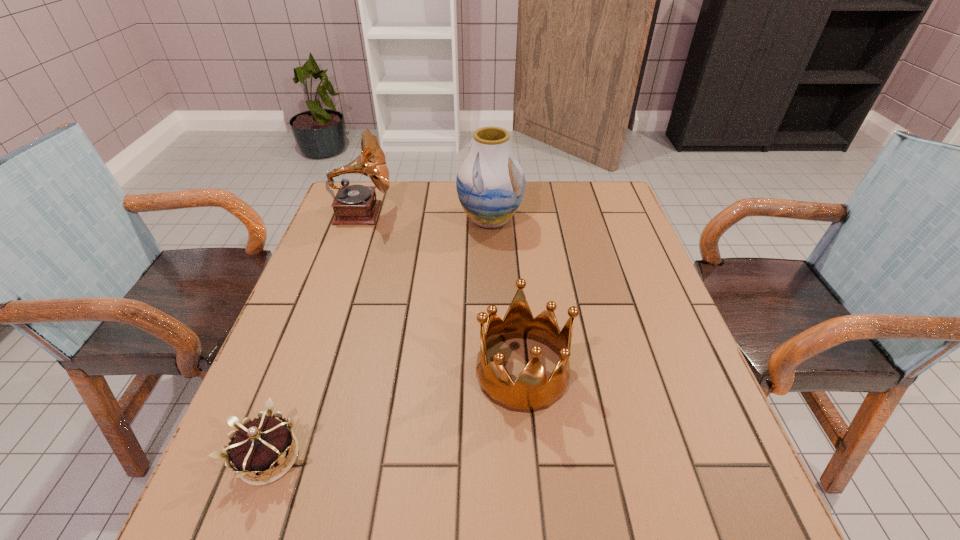
The width and height of the screenshot is (960, 540). I want to click on empty space that is in between the vase and the right crown, so click(x=506, y=296).

The image size is (960, 540). Identify the location of unoccupied position between the phonograph_record and the nearest object. (316, 335).

Select which object appears as the third closest to the phonograph_record. Please provide its 2D coordinates. Your answer should be formatted as a tuple, i.e. [(x, y)], where the tuple contains the x and y coordinates of a point satisfying the conditions above.

[(259, 446)]

Choose which object is the nearest neighbor to the right crown. Please provide its 2D coordinates. Your answer should be formatted as a tuple, i.e. [(x, y)], where the tuple contains the x and y coordinates of a point satisfying the conditions above.

[(259, 446)]

Identify the location of vacant region that satisfies the following two spatial constraints: 1. on the back side of the vase; 2. on the right side of the nearest object. This screenshot has height=540, width=960. (355, 220).

This screenshot has width=960, height=540. What are the coordinates of `vacant region that satisfies the following two spatial constraints: 1. on the horn of the third farthest object; 2. on the right side of the phonograph_record` in the screenshot? It's located at (307, 372).

Locate an element on the screen. This screenshot has height=540, width=960. free space that satisfies the following two spatial constraints: 1. on the horn of the phonograph_record; 2. on the front side of the shortest object is located at coordinates (277, 457).

The height and width of the screenshot is (540, 960). Identify the location of blank space that satisfies the following two spatial constraints: 1. on the horn of the farther crown; 2. on the left side of the phonograph_record. (307, 372).

What are the coordinates of `vacant position in the image that satisfies the following two spatial constraints: 1. on the horn of the taller crown; 2. on the left side of the phonograph_record` in the screenshot? It's located at (307, 372).

This screenshot has width=960, height=540. Find the location of `free space that satisfies the following two spatial constraints: 1. on the horn of the phonograph_record; 2. on the left side of the vase`. free space that satisfies the following two spatial constraints: 1. on the horn of the phonograph_record; 2. on the left side of the vase is located at coordinates (360, 220).